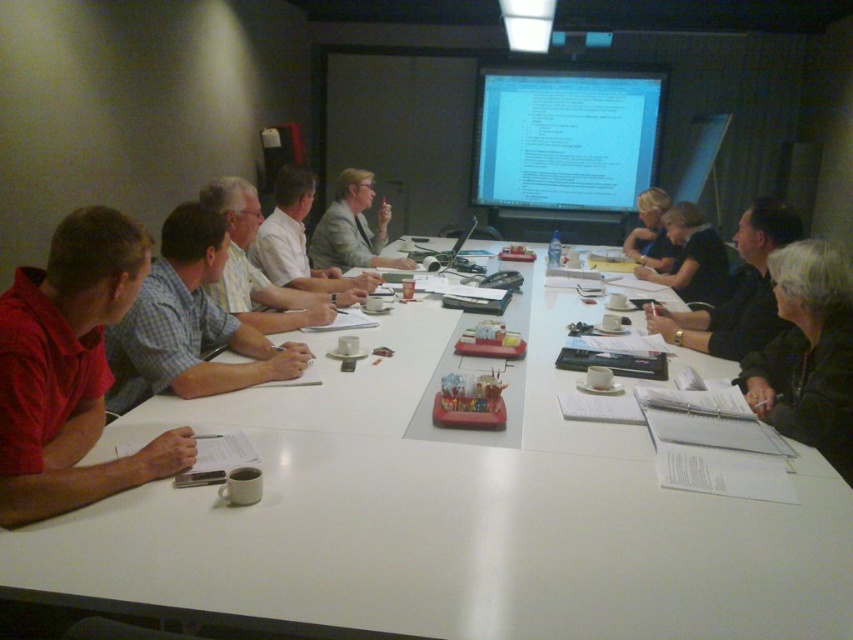
Can you confirm if dark gray shirt at center is positioned above blonde hair at upper right?

No, dark gray shirt at center is not above blonde hair at upper right.

Does point (672, 224) come closer to viewer compared to point (639, 218)?

Yes, point (672, 224) is closer to viewer.

Image resolution: width=853 pixels, height=640 pixels. I want to click on dark gray shirt at center, so click(x=689, y=257).

In the scene shown: Measure the distance between point (86, 218) and camera.

The distance of point (86, 218) from camera is 1.47 meters.

Between matte red shirt at left and light beige suit at center, which one has less height?

matte red shirt at left

Describe the element at coordinates (70, 371) in the screenshot. This screenshot has width=853, height=640. I see `matte red shirt at left` at that location.

Find the location of `matte red shirt at left`. matte red shirt at left is located at coordinates pos(70,371).

Does black shirt at right appear over matte white shirt at center?

Incorrect, black shirt at right is not positioned above matte white shirt at center.

How distant is black shirt at right from matte white shirt at center?

black shirt at right is 5.03 feet away from matte white shirt at center.

Locate an element on the screen. black shirt at right is located at coordinates (735, 291).